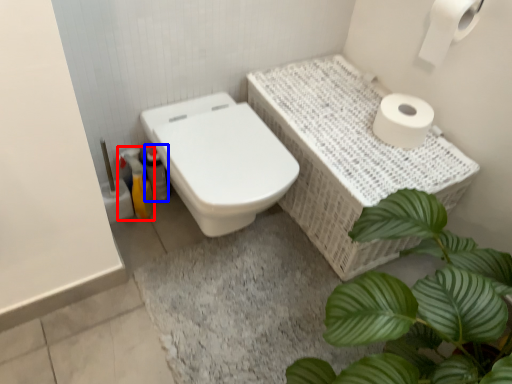
Question: Which object is closer to the camera taking this photo, cleaning product (highlighted by a red box) or bottle (highlighted by a blue box)?

Choices:
 (A) cleaning product
 (B) bottle

Answer: (A)